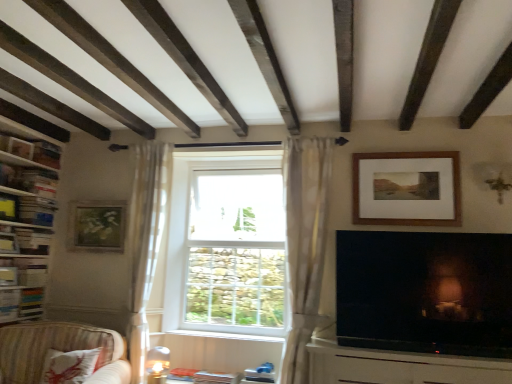
Question: From the image's perspective, is striped fabric couch at lower left under wooden bookshelf at left, the first shelf from the top?

Choices:
 (A) no
 (B) yes

Answer: (B)

Question: Can you confirm if striped fabric couch at lower left is taller than wooden bookshelf at left, the first shelf from the top?

Choices:
 (A) yes
 (B) no

Answer: (B)

Question: Is striped fabric couch at lower left far from wooden bookshelf at left, acting as the 2th shelf starting from the bottom?

Choices:
 (A) no
 (B) yes

Answer: (A)

Question: Is striped fabric couch at lower left at the left side of wooden bookshelf at left, acting as the 2th shelf starting from the bottom?

Choices:
 (A) no
 (B) yes

Answer: (A)

Question: Is striped fabric couch at lower left facing away from wooden bookshelf at left, the first shelf from the top?

Choices:
 (A) yes
 (B) no

Answer: (B)

Question: Is striped fabric couch at lower left smaller than wooden bookshelf at left, the first shelf from the top?

Choices:
 (A) no
 (B) yes

Answer: (B)

Question: Considering the relative sizes of white painted wood at center and white sheer curtain at left, the 2th curtain positioned from the right, in the image provided, is white painted wood at center wider than white sheer curtain at left, the 2th curtain positioned from the right,?

Choices:
 (A) no
 (B) yes

Answer: (A)

Question: Is white painted wood at center facing towards white sheer curtain at left, acting as the 1th curtain starting from the left?

Choices:
 (A) yes
 (B) no

Answer: (B)

Question: Is white sheer curtain at left, acting as the 1th curtain starting from the left, a part of white painted wood at center?

Choices:
 (A) yes
 (B) no

Answer: (B)

Question: Considering the relative positions of white painted wood at center and white sheer curtain at left, the 2th curtain positioned from the right, in the image provided, is white painted wood at center to the left of white sheer curtain at left, the 2th curtain positioned from the right, from the viewer's perspective?

Choices:
 (A) no
 (B) yes

Answer: (A)

Question: Considering the relative sizes of white painted wood at center and white sheer curtain at left, the 2th curtain positioned from the right, in the image provided, is white painted wood at center shorter than white sheer curtain at left, the 2th curtain positioned from the right,?

Choices:
 (A) yes
 (B) no

Answer: (A)

Question: Is white painted wood at center positioned with its back to white sheer curtain at left, acting as the 1th curtain starting from the left?

Choices:
 (A) yes
 (B) no

Answer: (B)

Question: Is wooden bookshelf at left, which is the 2th shelf from top to bottom, smaller than sheer white curtain at center, positioned as the 2th curtain in left-to-right order?

Choices:
 (A) yes
 (B) no

Answer: (A)